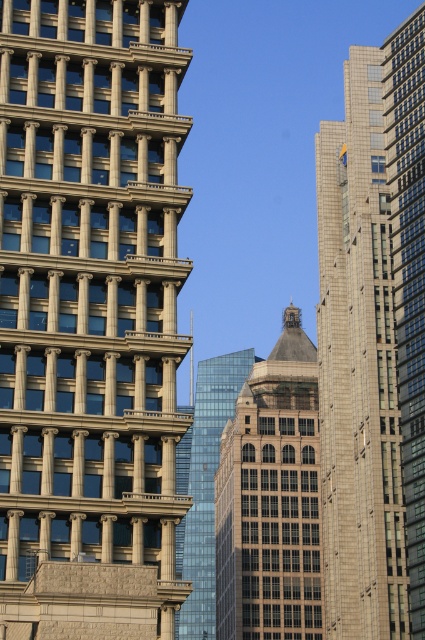
Is gray stone skyscraper at center smaller than dark gray glass tower at center?

Incorrect, gray stone skyscraper at center is not smaller in size than dark gray glass tower at center.

Is gray stone skyscraper at center shorter than dark gray glass tower at center?

In fact, gray stone skyscraper at center may be taller than dark gray glass tower at center.

Between point (353, 310) and point (258, 428), which one is positioned behind?

The point (258, 428) is more distant.

I want to click on gray stone skyscraper at center, so click(359, 369).

Can you confirm if beige stone tower at left is positioned above dark gray glass tower at center?

Correct, beige stone tower at left is located above dark gray glass tower at center.

Where is `beige stone tower at left`? The width and height of the screenshot is (425, 640). beige stone tower at left is located at coordinates (90, 317).

Does point (360, 486) come behind point (209, 550)?

No.

Does gray stone skyscraper at center lie behind glassy blue skyscraper at center?

Yes, it is behind glassy blue skyscraper at center.

Is point (337, 211) positioned behind point (197, 627)?

No, (337, 211) is closer to viewer.

The image size is (425, 640). I want to click on gray stone skyscraper at center, so click(359, 369).